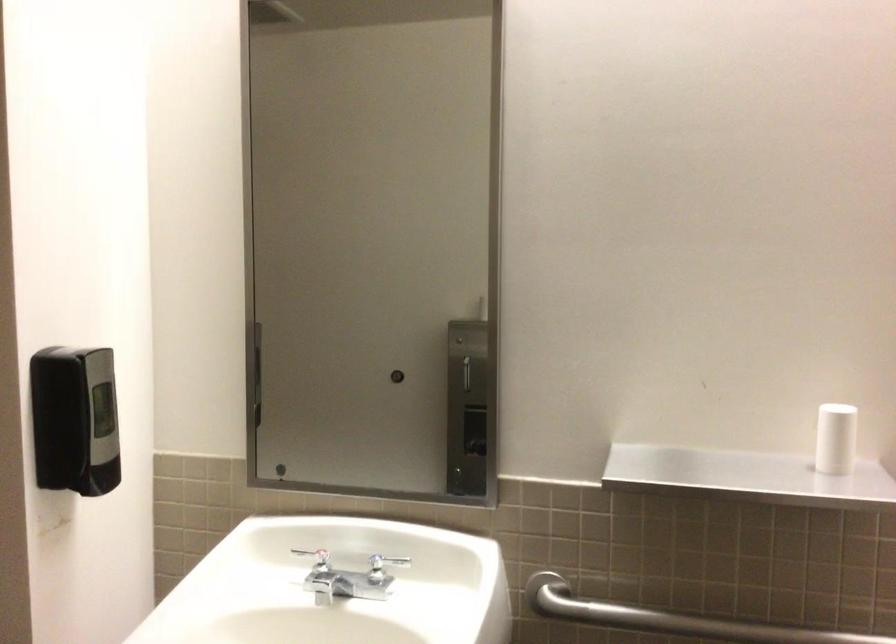
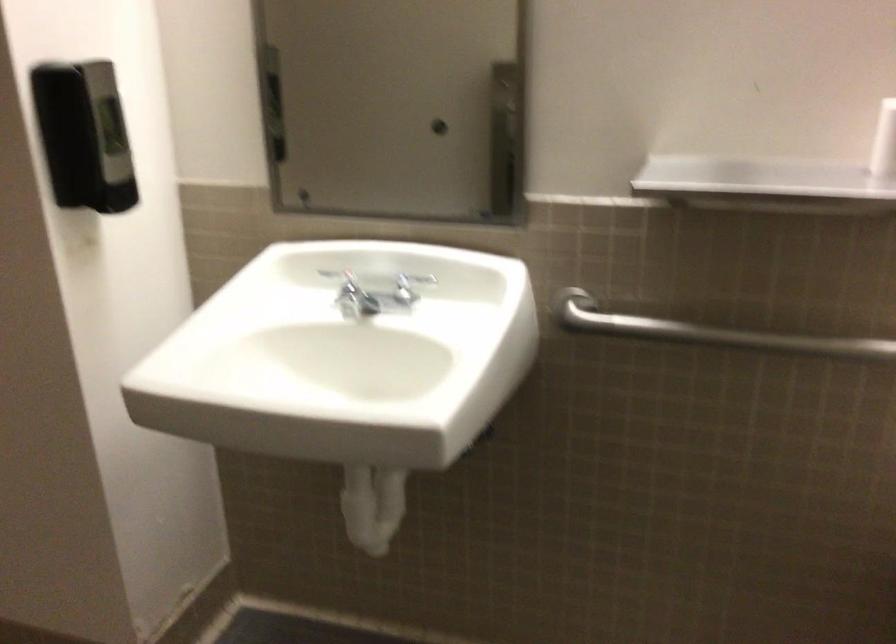
Question: The images are taken continuously from a first-person perspective. In which direction is your viewpoint rotating?

Choices:
 (A) Left
 (B) Right
 (C) Up
 (D) Down

Answer: (D)